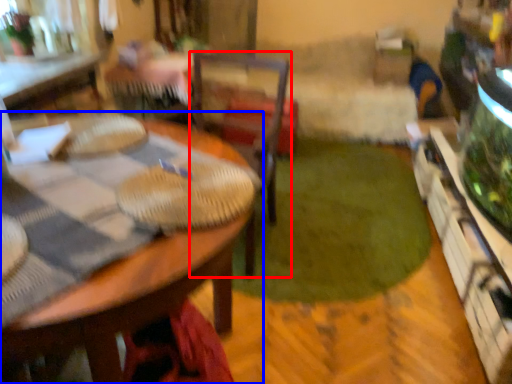
Question: Which object appears closest to the camera in this image, chair (highlighted by a red box) or table (highlighted by a blue box)?

Choices:
 (A) chair
 (B) table

Answer: (B)